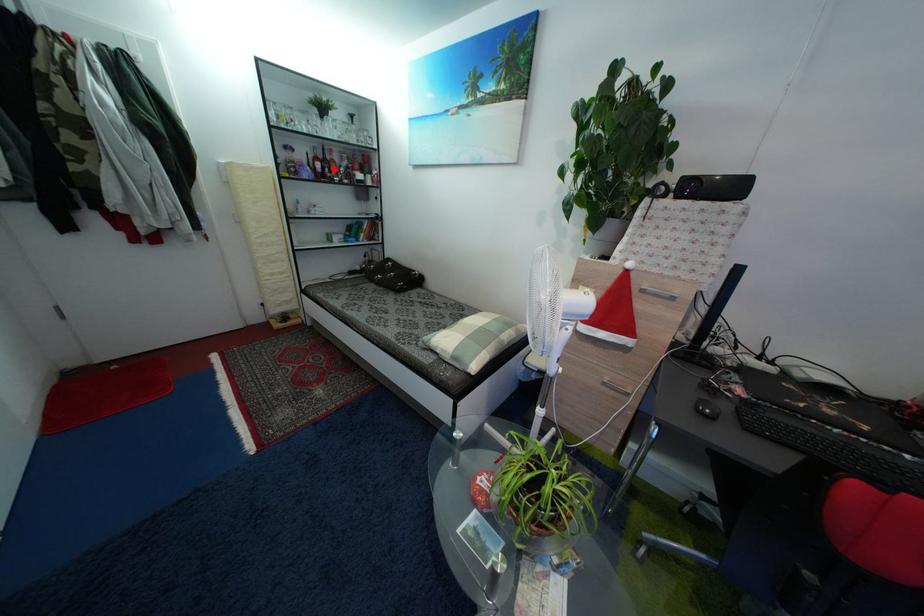
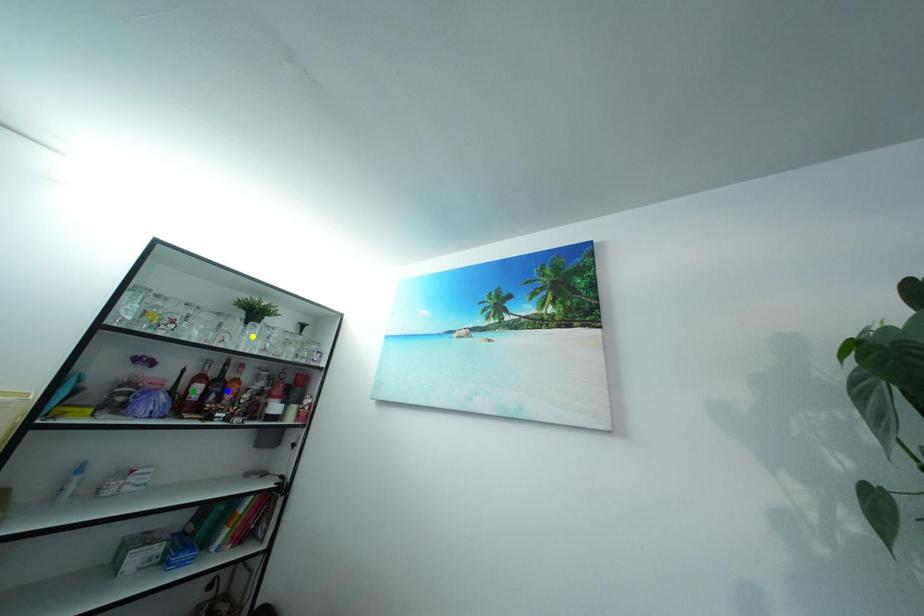
Question: I am providing you with two images of the same scene from different viewpoints. A red point is marked on the first image. You are given multiple points on the second image. Can you choose the point in image 2 that corresponds to the point in image 1?

Choices:
 (A) green point
 (B) blue point
 (C) yellow point

Answer: (B)